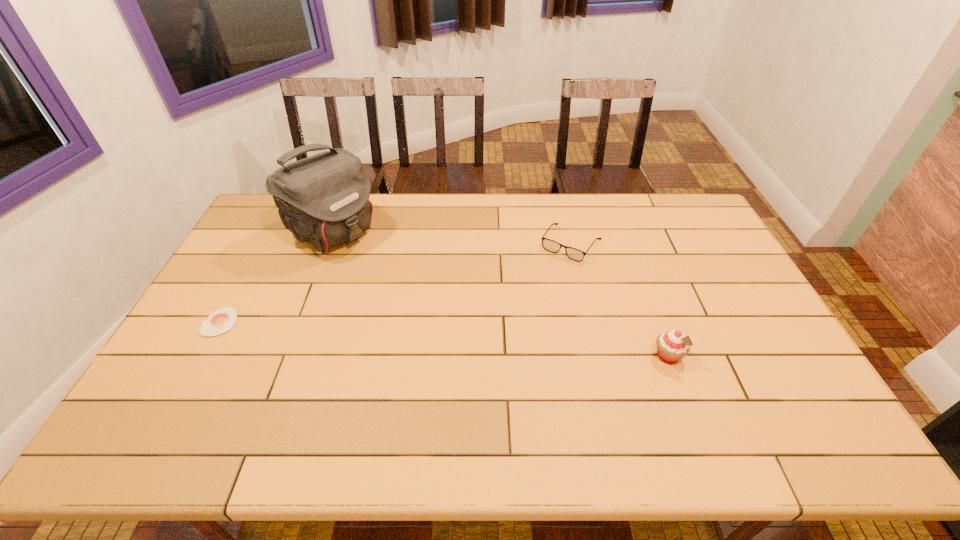
You are a GUI agent. You are given a task and a screenshot of the screen. Output one action in this format:
    pyautogui.click(x=<x>, y=<y>)
    Task: Click on the vacant space on the desktop that is between the leftmost object and the nearest object and is positioned on the open flap of the tallest object
    Image resolution: width=960 pixels, height=540 pixels.
    Given the screenshot: What is the action you would take?
    pyautogui.click(x=478, y=341)

The height and width of the screenshot is (540, 960). Find the location of `vacant space on the desktop that is between the shortest object and the rightmost object and is positioned on the front-facing side of the third object from left to right`. vacant space on the desktop that is between the shortest object and the rightmost object and is positioned on the front-facing side of the third object from left to right is located at coordinates (503, 343).